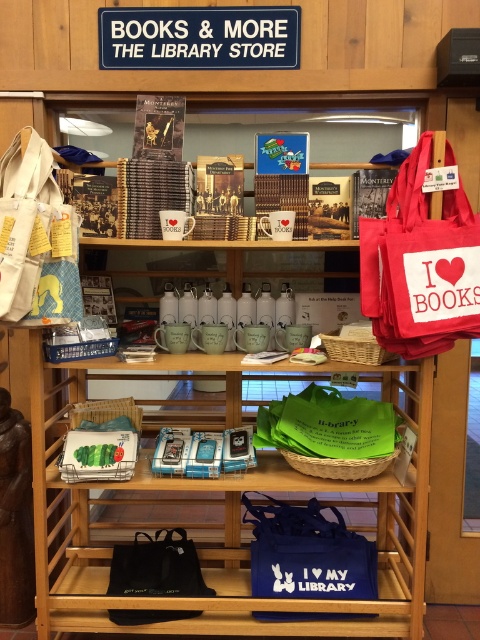
Question: Among these objects, which one is nearest to the camera?

Choices:
 (A) green fabric tote at center
 (B) white canvas tote at left
 (C) red canvas tote at upper right

Answer: (B)

Question: Can you confirm if red canvas tote at upper right is thinner than black fabric tote at lower left?

Choices:
 (A) yes
 (B) no

Answer: (A)

Question: In this image, where is red canvas tote at upper right located relative to white canvas tote at left?

Choices:
 (A) left
 (B) right

Answer: (B)

Question: Considering the relative positions of red canvas tote at upper right and black fabric tote at lower left in the image provided, where is red canvas tote at upper right located with respect to black fabric tote at lower left?

Choices:
 (A) left
 (B) right

Answer: (B)

Question: Which object is closer to the camera taking this photo?

Choices:
 (A) black fabric tote at lower left
 (B) red canvas tote at upper right

Answer: (B)

Question: Which point is farther to the camera?

Choices:
 (A) (260, 419)
 (B) (16, 193)
 (C) (410, 260)

Answer: (A)